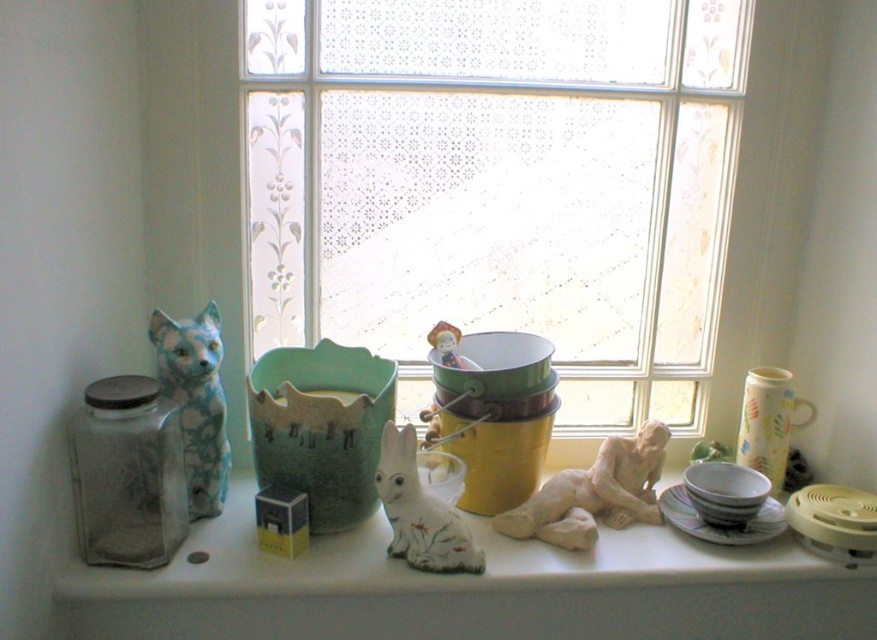
Based on the photo, between white matte rabbit at center and matte ceramic vase at right, which one appears on the right side from the viewer's perspective?

matte ceramic vase at right is more to the right.

Which of these two, white matte rabbit at center or matte ceramic vase at right, stands shorter?

With less height is white matte rabbit at center.

Who is more distant from viewer, (x=487, y=554) or (x=771, y=419)?

Positioned behind is point (x=771, y=419).

What are the coordinates of `white matte rabbit at center` in the screenshot? It's located at (439, 576).

Between transparent glass window at center and yellow matte bucket at center, which one has less height?

With less height is yellow matte bucket at center.

Find the location of a particular element. Image resolution: width=877 pixels, height=640 pixels. transparent glass window at center is located at coordinates (498, 182).

Can you confirm if yellow matte bucket at center is smaller than porcelain plate at center?

No.

Locate an element on the screen. The width and height of the screenshot is (877, 640). yellow matte bucket at center is located at coordinates point(496,416).

I want to click on yellow matte bucket at center, so click(x=496, y=416).